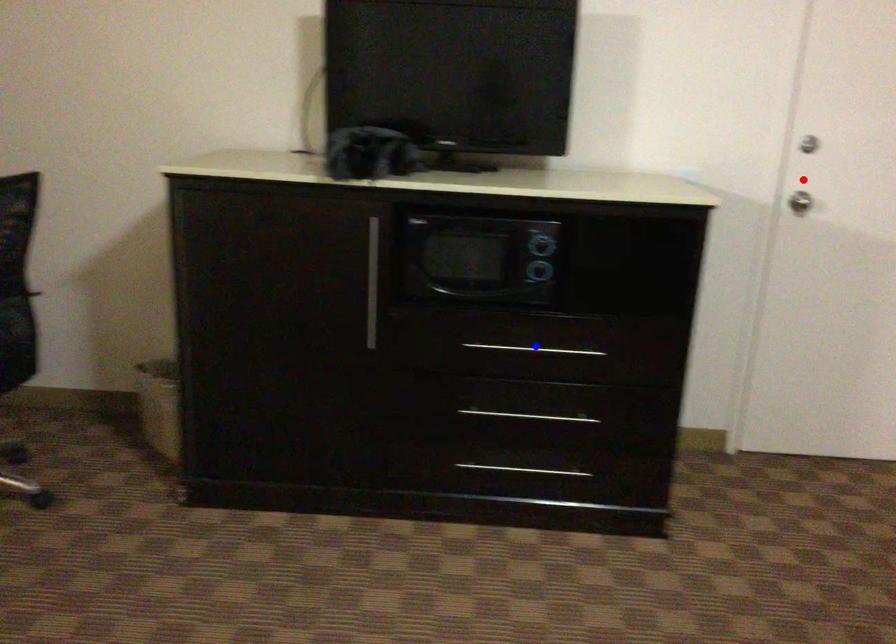
Question: Two points are marked on the image. Which point is closer to the camera?

Choices:
 (A) Blue point is closer.
 (B) Red point is closer.

Answer: (A)